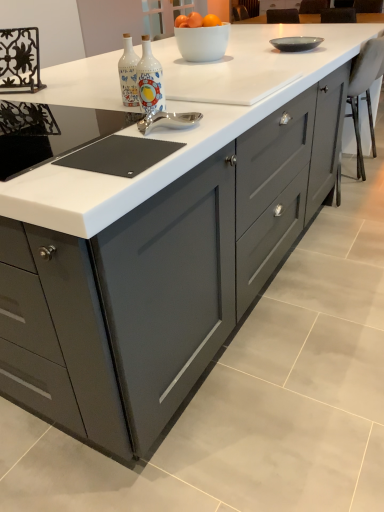
Question: Would you consider matte gray bowl at upper right to be distant from white fabric chair at right?

Choices:
 (A) no
 (B) yes

Answer: (A)

Question: Is matte gray bowl at upper right bigger than white fabric chair at right?

Choices:
 (A) no
 (B) yes

Answer: (A)

Question: Is matte gray bowl at upper right looking in the opposite direction of white fabric chair at right?

Choices:
 (A) yes
 (B) no

Answer: (B)

Question: Considering the relative positions of matte gray bowl at upper right and white fabric chair at right in the image provided, is matte gray bowl at upper right to the right of white fabric chair at right from the viewer's perspective?

Choices:
 (A) yes
 (B) no

Answer: (B)

Question: From a real-world perspective, is matte gray bowl at upper right under white fabric chair at right?

Choices:
 (A) yes
 (B) no

Answer: (B)

Question: From a real-world perspective, does matte gray bowl at upper right stand above white fabric chair at right?

Choices:
 (A) yes
 (B) no

Answer: (A)

Question: Considering the relative sizes of white fabric chair at right and black glass gas stove at center in the image provided, is white fabric chair at right thinner than black glass gas stove at center?

Choices:
 (A) yes
 (B) no

Answer: (A)

Question: Is white fabric chair at right bigger than black glass gas stove at center?

Choices:
 (A) yes
 (B) no

Answer: (A)

Question: Is white fabric chair at right turned away from black glass gas stove at center?

Choices:
 (A) yes
 (B) no

Answer: (B)

Question: Considering the relative sizes of white fabric chair at right and black glass gas stove at center in the image provided, is white fabric chair at right taller than black glass gas stove at center?

Choices:
 (A) no
 (B) yes

Answer: (B)

Question: Does white fabric chair at right have a greater width compared to black glass gas stove at center?

Choices:
 (A) no
 (B) yes

Answer: (A)

Question: Can you confirm if white fabric chair at right is positioned to the left of black glass gas stove at center?

Choices:
 (A) no
 (B) yes

Answer: (A)

Question: Can you confirm if decorative ceramic bottles at center is thinner than matte gray bowl at upper right?

Choices:
 (A) no
 (B) yes

Answer: (B)